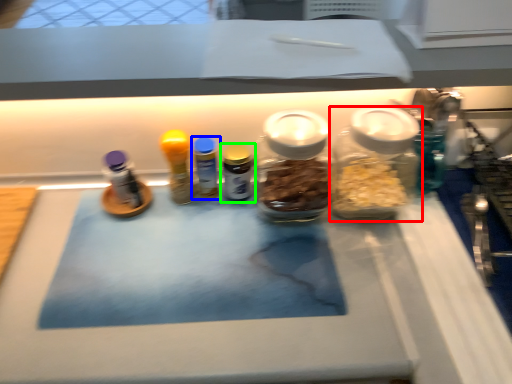
Question: Which is nearer to the bottle (highlighted by a red box)? bottle (highlighted by a blue box) or bottle (highlighted by a green box).

Choices:
 (A) bottle
 (B) bottle

Answer: (B)